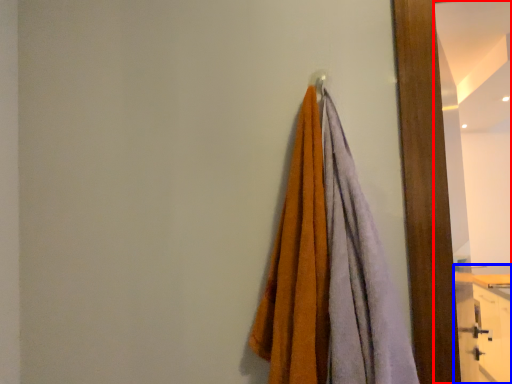
Question: Which object is further to the camera taking this photo, mirror (highlighted by a red box) or dresser (highlighted by a blue box)?

Choices:
 (A) mirror
 (B) dresser

Answer: (B)